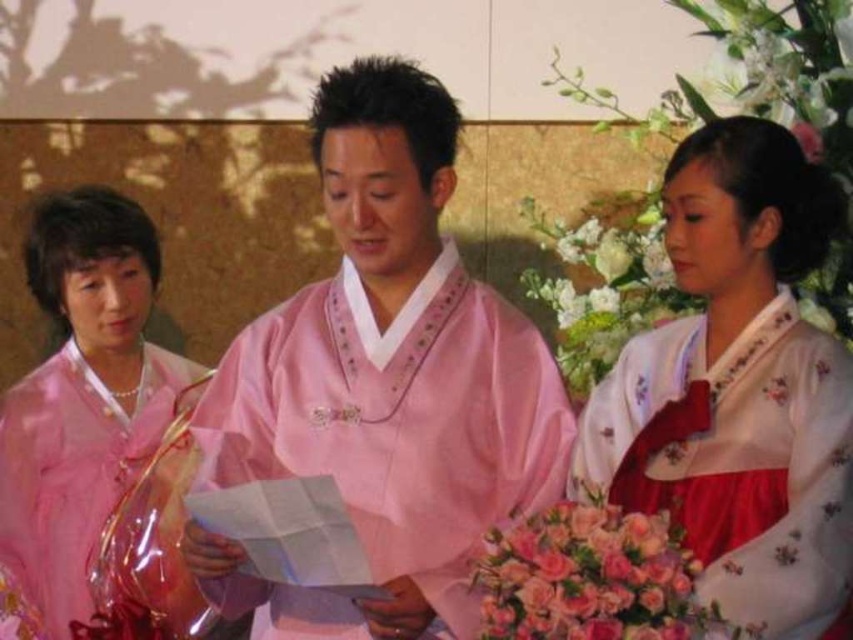
Consider the image. You are a photographer at the event and need to position yourself to capture the pink satin kimono at center in the best possible way. Based on its coordinates, where should you aim your camera?

The pink satin kimono at center is located at coordinates point (386,380), so you should aim your camera towards that position to capture it effectively.

You are a photographer at a wedding ceremony. You need to capture a photo of the satin pink hanbok at left and the pink floral bouquet at lower right. Which object should you focus on first if you want to include both in the frame without moving the camera?

The satin pink hanbok at left is much taller than the pink floral bouquet at lower right, so you should focus on the taller satin pink hanbok at left first to ensure it fits within the frame.

Looking at this image, you are attending a traditional Korean wedding ceremony and see the satin pink hanbok at left and the pink floral bouquet at lower right. Which object is placed higher in the image?

The satin pink hanbok at left is positioned over the pink floral bouquet at lower right, so it is placed higher in the image.